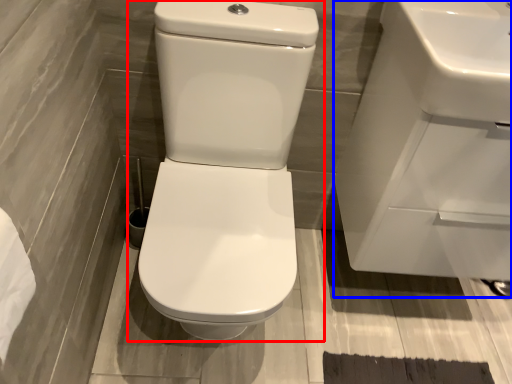
Question: Which of the following is the closest to the observer, toilet (highlighted by a red box) or sink (highlighted by a blue box)?

Choices:
 (A) toilet
 (B) sink

Answer: (A)